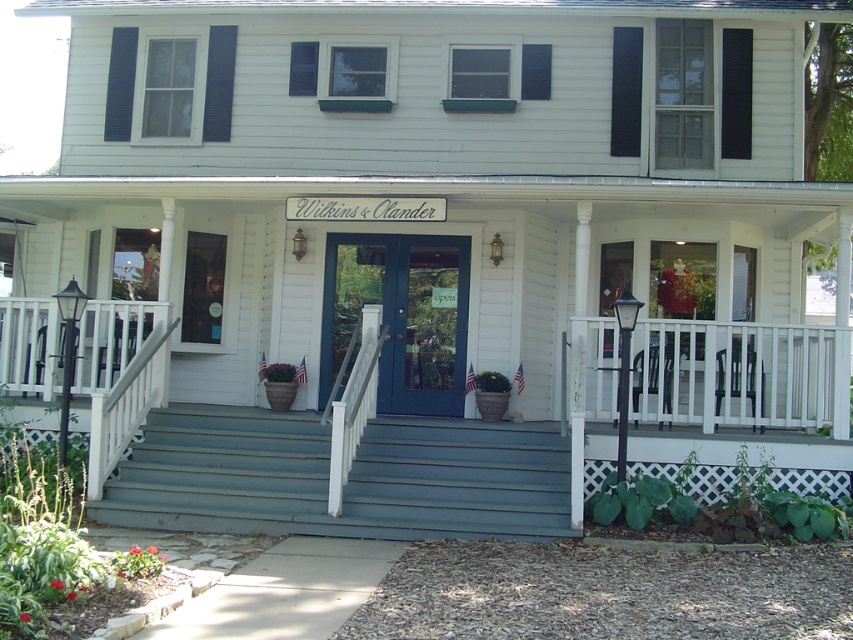
Is white wooden porch at center bigger than teal painted wood stairs at center?

Correct, white wooden porch at center is larger in size than teal painted wood stairs at center.

Does white wooden porch at center appear on the left side of teal painted wood stairs at center?

Incorrect, white wooden porch at center is not on the left side of teal painted wood stairs at center.

Between point (44, 243) and point (195, 419), which one is positioned in front?

Positioned in front is point (195, 419).

The height and width of the screenshot is (640, 853). Identify the location of white wooden porch at center. (438, 336).